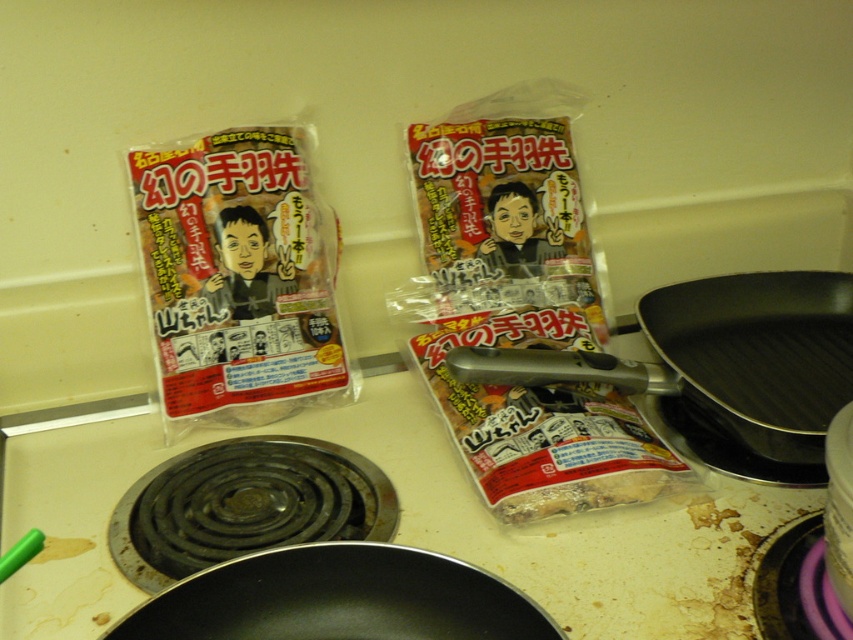
Question: Does black matte gas stove at lower left have a larger size compared to matte plastic bag of chicken at left?

Choices:
 (A) yes
 (B) no

Answer: (A)

Question: Is black matte gas stove at lower left thinner than matte plastic bag of chicken at left?

Choices:
 (A) yes
 (B) no

Answer: (B)

Question: Which point is farther to the camera?

Choices:
 (A) black non-stick pan at center
 (B) black matte gas stove at lower left

Answer: (A)

Question: Considering the real-world distances, which object is closest to the black non-stick pan at center?

Choices:
 (A) matte plastic bag of chicken at left
 (B) black non-stick frying pan at lower left
 (C) black matte gas stove at lower left

Answer: (C)

Question: Among these objects, which one is farthest from the camera?

Choices:
 (A) black non-stick frying pan at lower left
 (B) black matte gas stove at lower left

Answer: (B)

Question: Does black matte gas stove at lower left appear on the right side of matte plastic bag of chicken at left?

Choices:
 (A) yes
 (B) no

Answer: (A)